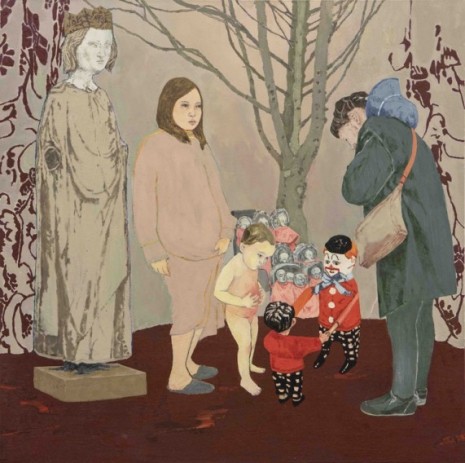
Locate an element on the screen. The image size is (465, 463). grey slippers is located at coordinates (203, 384), (209, 373).